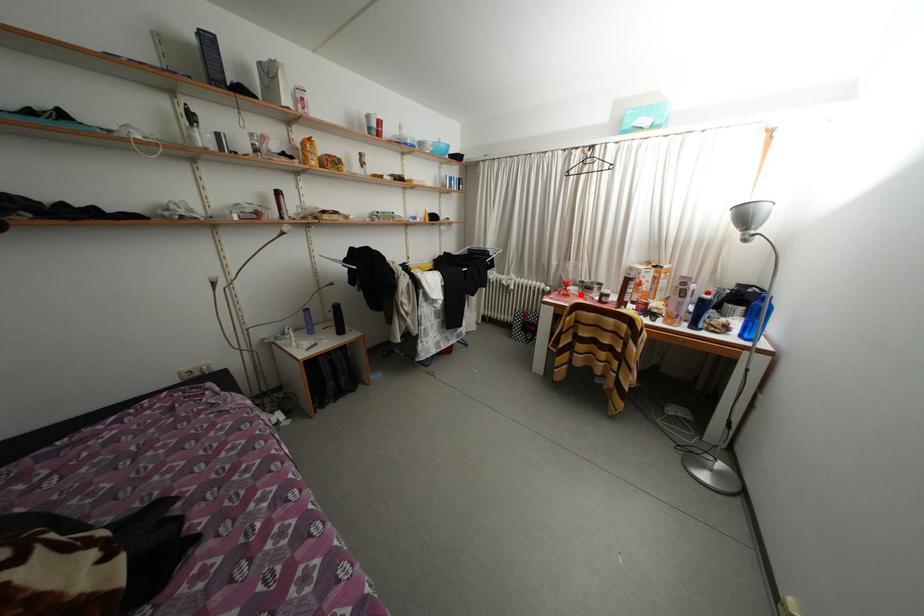
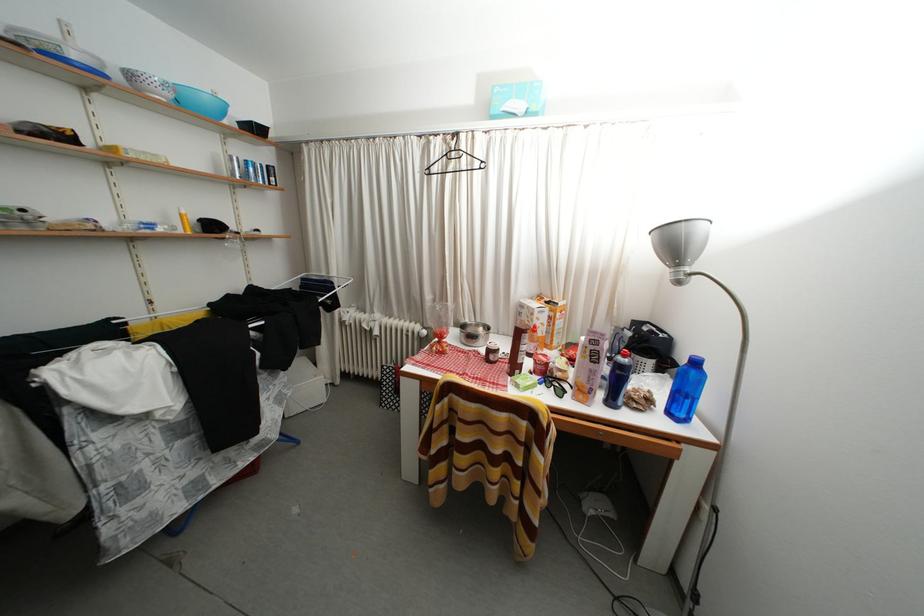
The point at the highlighted location is marked in the first image. Where is the corresponding point in the second image?

(460, 342)